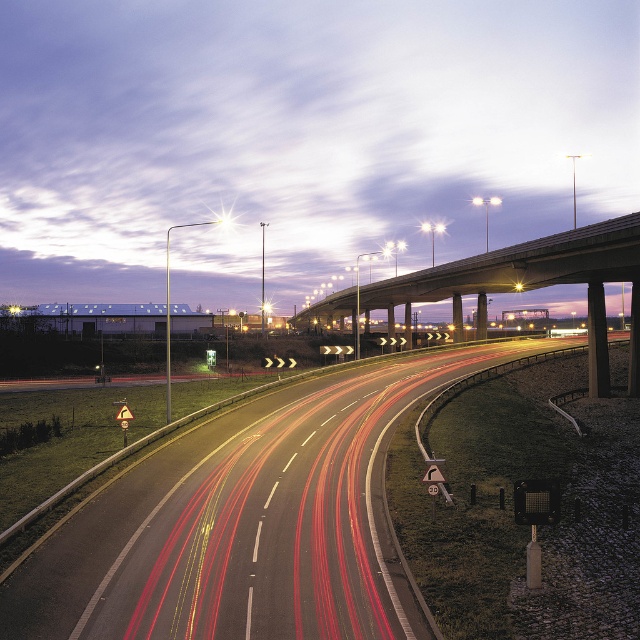
Is smooth asphalt highway at center closer to the viewer compared to concrete bridge at upper center?

That is True.

Can you confirm if smooth asphalt highway at center is positioned to the right of concrete bridge at upper center?

In fact, smooth asphalt highway at center is to the left of concrete bridge at upper center.

Image resolution: width=640 pixels, height=640 pixels. What do you see at coordinates (248, 524) in the screenshot? I see `smooth asphalt highway at center` at bounding box center [248, 524].

This screenshot has width=640, height=640. What are the coordinates of `smooth asphalt highway at center` in the screenshot? It's located at (248, 524).